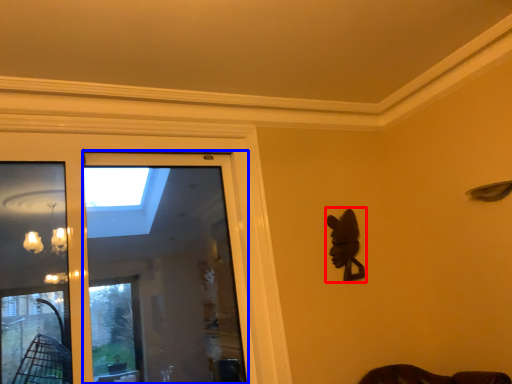
Question: Which of the following is the closest to the observer, animal (highlighted by a red box) or screen door (highlighted by a blue box)?

Choices:
 (A) animal
 (B) screen door

Answer: (B)